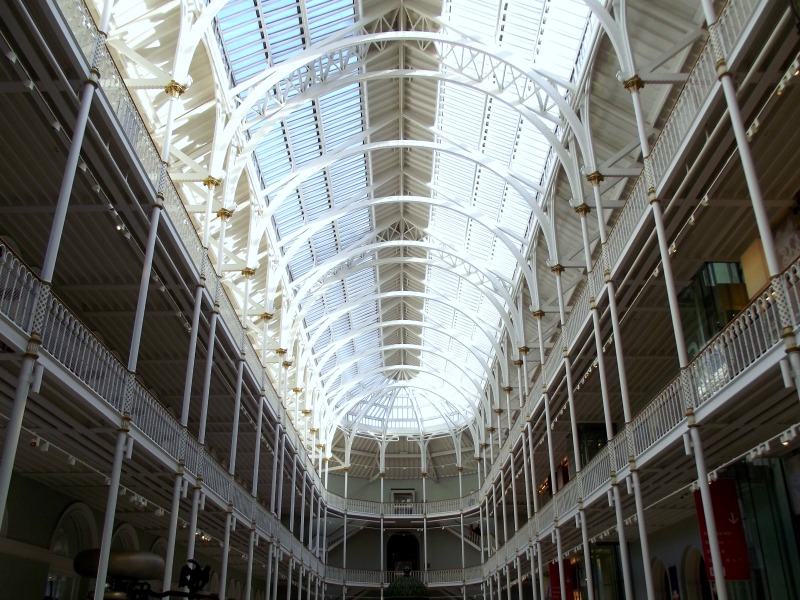
You are a GUI agent. You are given a task and a screenshot of the screen. Output one action in this format:
    pyautogui.click(x=<x>, y=<y>)
    Task: Click on the doors
    The width and height of the screenshot is (800, 600).
    Given the screenshot: What is the action you would take?
    pyautogui.click(x=661, y=584), pyautogui.click(x=697, y=584), pyautogui.click(x=393, y=555), pyautogui.click(x=404, y=495)